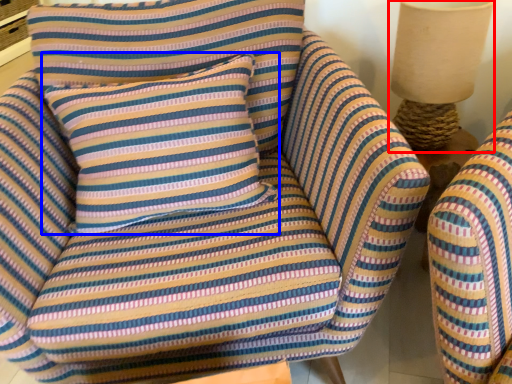
Question: Which object is further to the camera taking this photo, table lamp (highlighted by a red box) or pillow (highlighted by a blue box)?

Choices:
 (A) table lamp
 (B) pillow

Answer: (A)